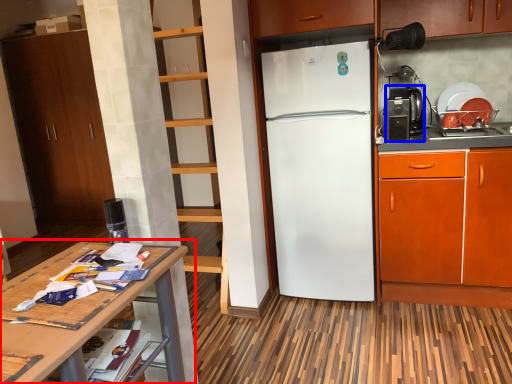
Question: Among these objects, which one is nearest to the camera, table (highlighted by a red box) or coffee machine (highlighted by a blue box)?

Choices:
 (A) table
 (B) coffee machine

Answer: (A)